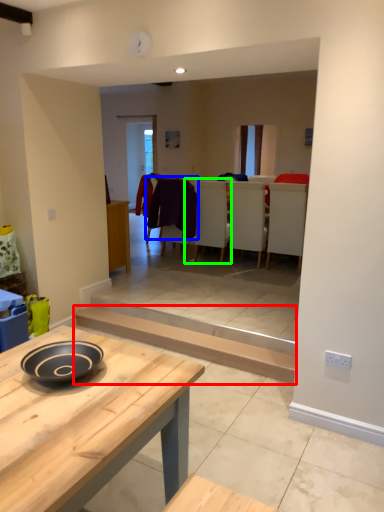
Question: Which object is the closest to the plank (highlighted by a red box)? Choose among these: laundry (highlighted by a blue box) or armchair (highlighted by a green box).

Choices:
 (A) laundry
 (B) armchair

Answer: (A)